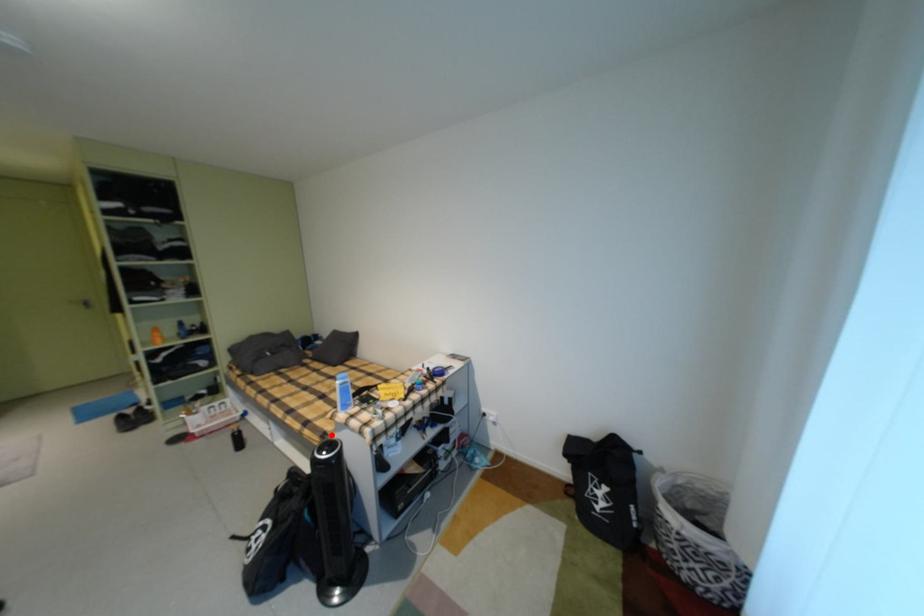
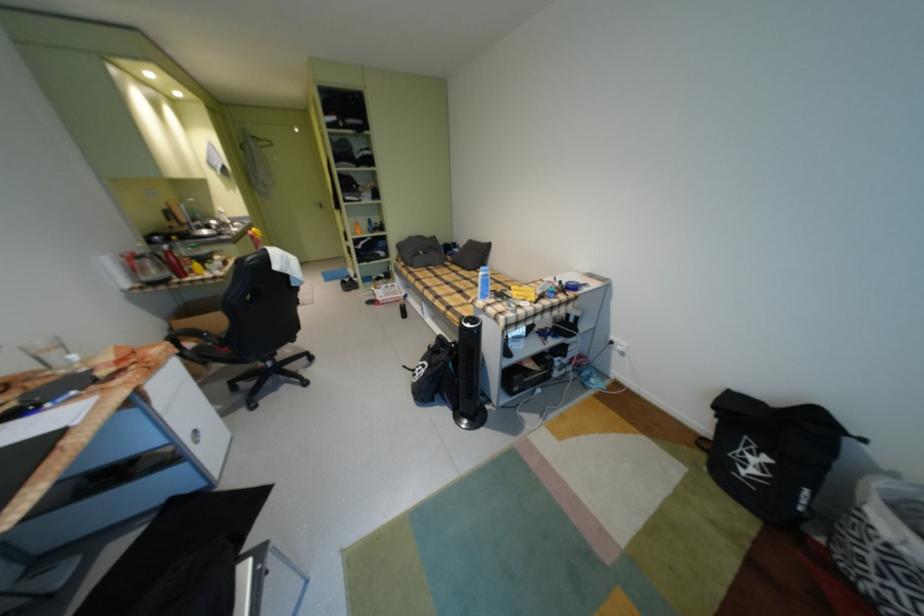
Question: A red point is marked in image1. In image2, is the corresponding 3D point closer to the camera or farther? Reply with the corresponding letter.

Choices:
 (A) The corresponding 3D point is closer.
 (B) The corresponding 3D point is farther.

Answer: (A)